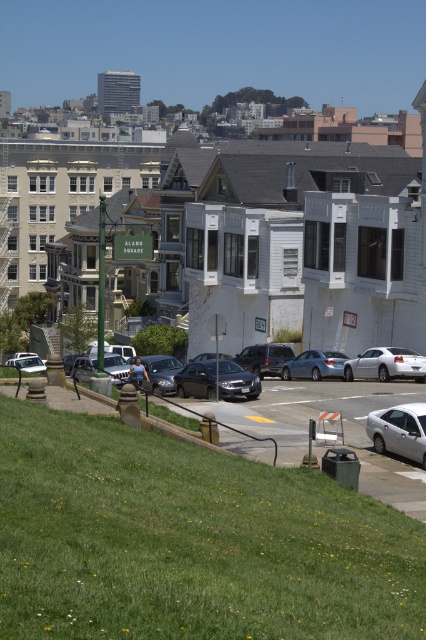
You are a delivery driver who needs to back out of the parking spot between the satin silver sedan at center and the satin black suv at center. Can you safely back out without hitting either vehicle?

The satin silver sedan at center is in front of the satin black suv at center, so you can safely back out as long as you ensure there is enough space behind the satin black suv at center to maneuver without collision.

You are a photographer planning to capture both the silver metallic sedan at lower right and the shiny silver sedan at center in a single shot. Which sedan should you position closer to the camera to ensure both are visible clearly in the frame?

To ensure both the silver metallic sedan at lower right and the shiny silver sedan at center are visible clearly in the frame, you should position the silver metallic sedan at lower right closer to the camera since it is smaller than the shiny silver sedan at center.